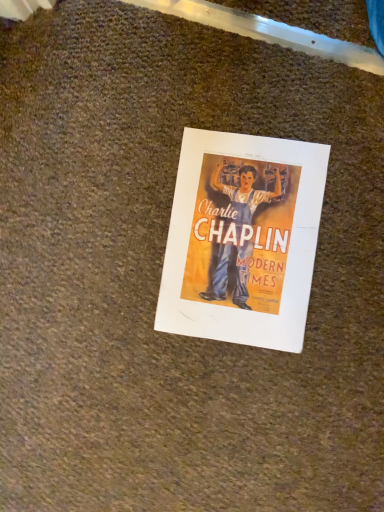
Find the location of a particular element. This screenshot has height=512, width=384. free space above matte paper poster at center (from a real-world perspective) is located at coordinates (242, 241).